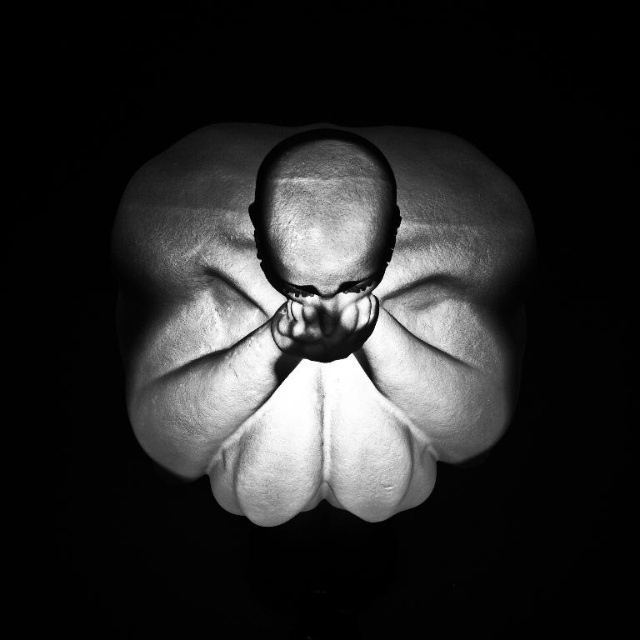
In the black and white photograph, you see the smooth flesh flower at center and the smooth skin hand at center. Which object is taller?

The smooth flesh flower at center is taller than the smooth skin hand at center.